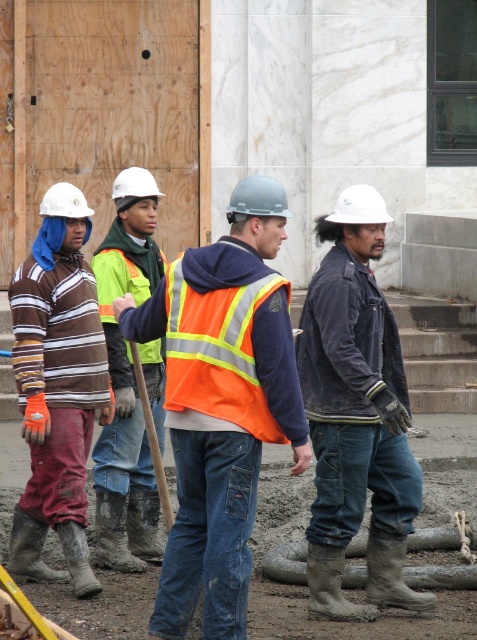
Question: Does dark gray leather jacket at center have a lesser width compared to matte brown striped shirt at left?

Choices:
 (A) no
 (B) yes

Answer: (A)

Question: Which of the following is the farthest from the observer?

Choices:
 (A) dark gray leather jacket at center
 (B) orange reflective vest at center
 (C) matte brown striped shirt at left

Answer: (C)

Question: Is matte brown striped shirt at left positioned behind reflective orange safety vest at center?

Choices:
 (A) no
 (B) yes

Answer: (A)

Question: Based on their relative distances, which object is farther from the orange reflective safety vest at center?

Choices:
 (A) matte brown striped shirt at left
 (B) orange reflective vest at center
 (C) reflective orange safety vest at center
 (D) dark gray leather jacket at center

Answer: (C)

Question: Considering the real-world distances, which object is closest to the reflective orange safety vest at center?

Choices:
 (A) orange reflective safety vest at center
 (B) dark gray leather jacket at center
 (C) orange reflective vest at center
 (D) matte brown striped shirt at left

Answer: (D)

Question: Can you confirm if dark gray leather jacket at center is thinner than reflective orange safety vest at center?

Choices:
 (A) no
 (B) yes

Answer: (A)